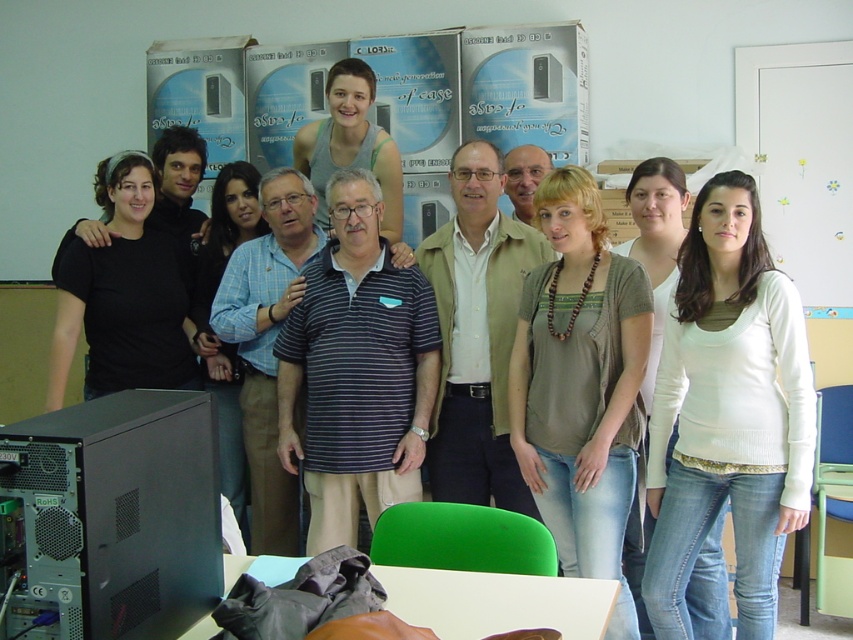
Question: Among these points, which one is nearest to the camera?

Choices:
 (A) (161, 305)
 (B) (242, 451)

Answer: (A)

Question: Does white soft sweater at center have a lesser width compared to white matte bulletin board at upper right?

Choices:
 (A) no
 (B) yes

Answer: (B)

Question: From the image, what is the correct spatial relationship of striped cotton polo shirt at center in relation to black matte shirt at left?

Choices:
 (A) left
 (B) right

Answer: (B)

Question: Which of the following is the closest to the observer?

Choices:
 (A) black matte computer at lower left
 (B) matte gray tank top at center
 (C) black matte shirt at left

Answer: (A)

Question: From the image, what is the correct spatial relationship of striped cotton polo shirt at center in relation to black matte shirt at left?

Choices:
 (A) left
 (B) right

Answer: (B)

Question: Which object is closer to the camera taking this photo?

Choices:
 (A) striped cotton polo shirt at center
 (B) white matte bulletin board at upper right

Answer: (A)